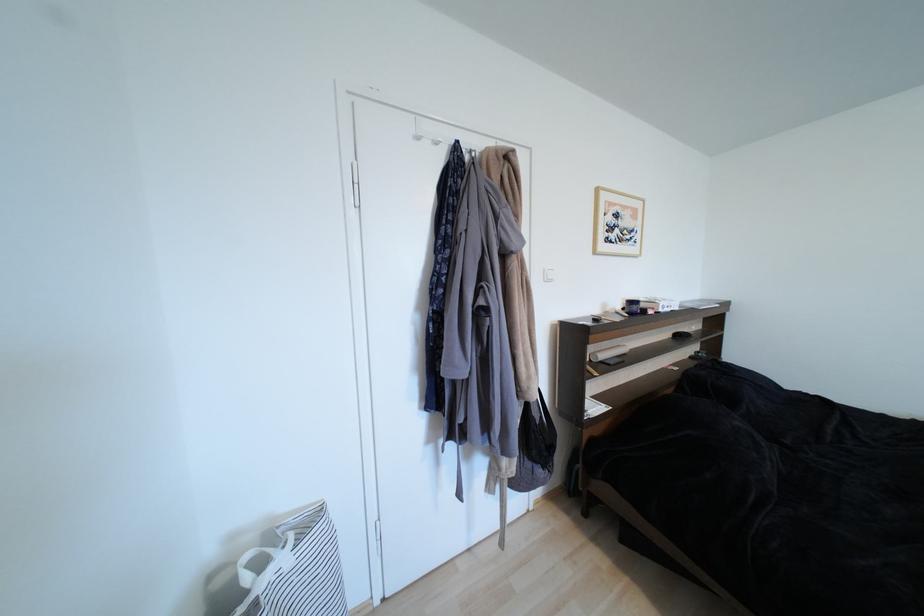
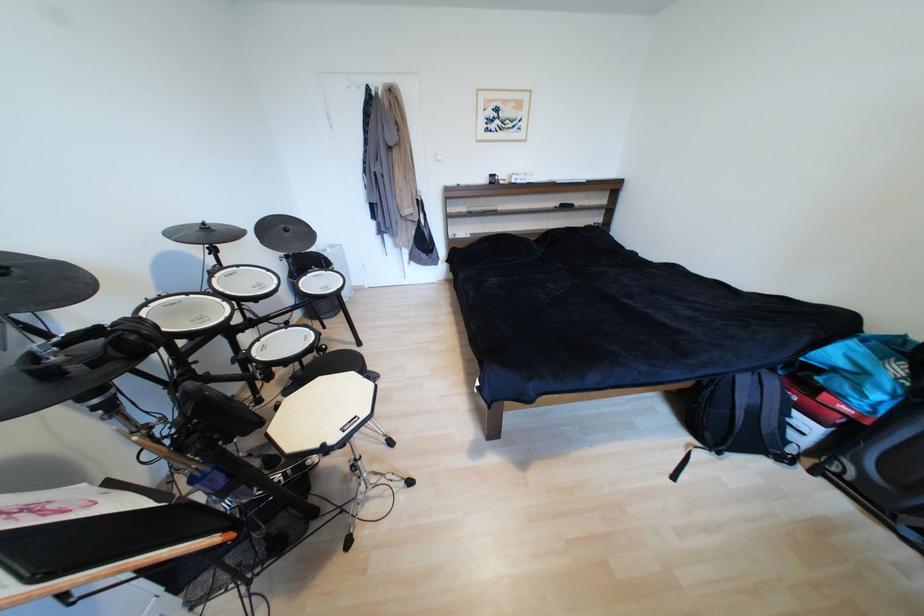
Find the pixel in the second image that matches (638,304) in the first image.

(499, 177)